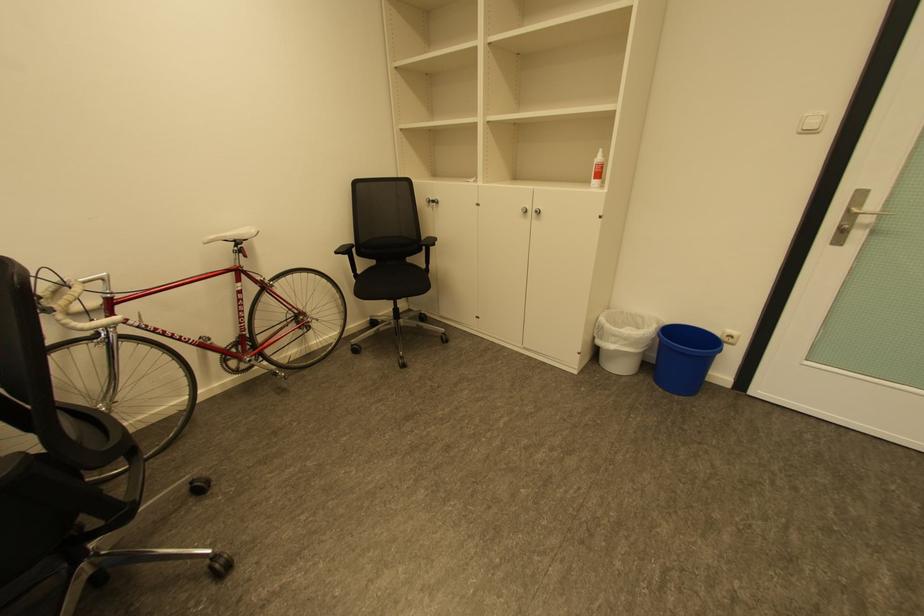
What do you see at coordinates (730, 336) in the screenshot? The image size is (924, 616). I see `a white power socket` at bounding box center [730, 336].